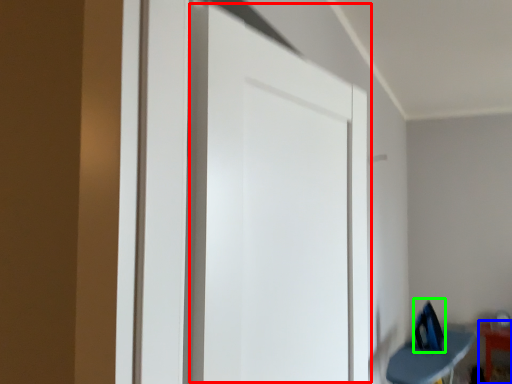
Question: Considering the real-world distances, which object is farthest from door (highlighted by a red box)? furniture (highlighted by a blue box) or swivel chair (highlighted by a green box)?

Choices:
 (A) furniture
 (B) swivel chair

Answer: (A)